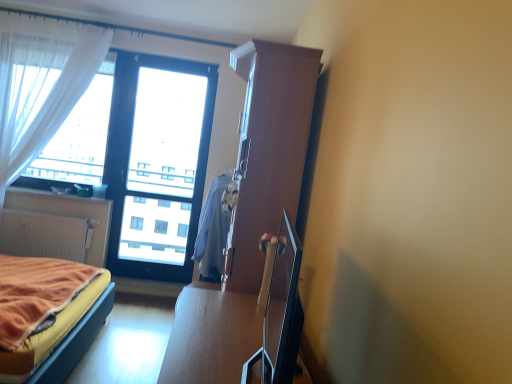
Based on the photo, in order to face matte white radiator at lower left, should I rotate leftwards or rightwards?

Rotate left and turn 26.183 degrees.

Describe the element at coordinates (50, 334) in the screenshot. This screenshot has height=384, width=512. I see `velvet orange bed at lower left` at that location.

Measure the distance between point (74, 96) and camera.

Point (74, 96) is 3.70 meters from camera.

Find the location of a particular element. The width and height of the screenshot is (512, 384). matte white radiator at lower left is located at coordinates (44, 235).

Based on their sizes in the image, would you say velvet orange bed at lower left is bigger or smaller than transparent glass window at center?

Clearly, velvet orange bed at lower left is larger in size than transparent glass window at center.

In the image, is velvet orange bed at lower left positioned in front of or behind transparent glass window at center?

velvet orange bed at lower left is positioned closer to the viewer than transparent glass window at center.

Are velvet orange bed at lower left and transparent glass window at center located far from each other?

Absolutely, velvet orange bed at lower left is distant from transparent glass window at center.

Looking at this image, from the image's perspective, is velvet orange bed at lower left below transparent glass window at center?

Correct, velvet orange bed at lower left appears lower than transparent glass window at center in the image.

Is point (41, 218) more distant than point (215, 239)?

Yes, it is.

Which object is thinner, matte white radiator at lower left or light blue fabric at center?

With smaller width is matte white radiator at lower left.

Which is correct: matte white radiator at lower left is inside light blue fabric at center, or outside of it?

matte white radiator at lower left is located beyond the bounds of light blue fabric at center.

Is matte white radiator at lower left placed right next to light blue fabric at center?

matte white radiator at lower left is not next to light blue fabric at center, and they're not touching.

Is white sheer curtain at left wider or thinner than velvet orange bed at lower left?

Clearly, white sheer curtain at left has less width compared to velvet orange bed at lower left.

Considering the sizes of objects white sheer curtain at left and velvet orange bed at lower left in the image provided, who is taller, white sheer curtain at left or velvet orange bed at lower left?

white sheer curtain at left.

From the image's perspective, which object appears higher, white sheer curtain at left or velvet orange bed at lower left?

white sheer curtain at left.

Is white sheer curtain at left at the right side of velvet orange bed at lower left?

Incorrect, white sheer curtain at left is not on the right side of velvet orange bed at lower left.

From the image's perspective, is matte white radiator at lower left under white sheer curtain at left?

Indeed, from the image's perspective, matte white radiator at lower left is shown beneath white sheer curtain at left.

Would you say matte white radiator at lower left is a long distance from white sheer curtain at left?

No.

Which is nearer, (x=3, y=215) or (x=76, y=69)?

Point (x=3, y=215) is farther from the camera than point (x=76, y=69).

Does point (222, 244) appear closer or farther from the camera than point (34, 243)?

Point (222, 244) is positioned closer to the camera compared to point (34, 243).

Is light blue fabric at center beside matte white radiator at lower left?

No, light blue fabric at center is not beside matte white radiator at lower left.

Considering the relative sizes of light blue fabric at center and matte white radiator at lower left in the image provided, is light blue fabric at center wider than matte white radiator at lower left?

Correct, the width of light blue fabric at center exceeds that of matte white radiator at lower left.

I want to click on radiator below the light blue fabric at center (from a real-world perspective), so click(x=44, y=235).

Measure the distance from transparent glass window at center to light blue fabric at center.

A distance of 1.55 meters exists between transparent glass window at center and light blue fabric at center.

Can we say transparent glass window at center lies outside light blue fabric at center?

Absolutely, transparent glass window at center is external to light blue fabric at center.

From the image's perspective, is transparent glass window at center above or below light blue fabric at center?

transparent glass window at center is above light blue fabric at center.

Is transparent glass window at center in contact with light blue fabric at center?

They are not placed beside each other.

What's the angular difference between white sheer curtain at left and light blue fabric at center's facing directions?

There is a 90.2-degree angle between the facing directions of white sheer curtain at left and light blue fabric at center.

Is white sheer curtain at left at the left side of light blue fabric at center?

Yes.

In the image, there is a white sheer curtain at left. In order to click on blanket below it (from the image's perspective) in this screenshot , I will do `click(212, 232)`.

I want to click on bed in front of the transparent glass window at center, so click(50, 334).

This screenshot has width=512, height=384. Identify the location of blanket located above the matte white radiator at lower left (from a real-world perspective). (212, 232).

Considering their positions, is white sheer curtain at left positioned further to matte white radiator at lower left than light blue fabric at center?

light blue fabric at center lies further to matte white radiator at lower left than the other object.

Based on their spatial positions, is white sheer curtain at left or transparent glass window at center closer to light blue fabric at center?

Among the two, transparent glass window at center is located nearer to light blue fabric at center.

When comparing their distances from matte white radiator at lower left, does transparent glass window at center or white sheer curtain at left seem closer?

white sheer curtain at left is closer to matte white radiator at lower left.

Estimate the real-world distances between objects in this image. Which object is closer to light blue fabric at center, velvet orange bed at lower left or matte white radiator at lower left?

velvet orange bed at lower left.

In the scene shown: Which object lies nearer to the anchor point white sheer curtain at left, light blue fabric at center or velvet orange bed at lower left?

Based on the image, velvet orange bed at lower left appears to be nearer to white sheer curtain at left.

Estimate the real-world distances between objects in this image. Which object is closer to transparent glass window at center, light blue fabric at center or velvet orange bed at lower left?

light blue fabric at center.

When comparing their distances from matte white radiator at lower left, does velvet orange bed at lower left or transparent glass window at center seem further?

The object further to matte white radiator at lower left is velvet orange bed at lower left.

Which object lies further to the anchor point transparent glass window at center, white sheer curtain at left or light blue fabric at center?

light blue fabric at center is further to transparent glass window at center.

Where is `blanket located between velvet orange bed at lower left and white sheer curtain at left in the depth direction`? The image size is (512, 384). blanket located between velvet orange bed at lower left and white sheer curtain at left in the depth direction is located at coordinates (212, 232).

Locate an element on the screen. The height and width of the screenshot is (384, 512). blanket located between velvet orange bed at lower left and transparent glass window at center in the depth direction is located at coordinates (212, 232).

This screenshot has width=512, height=384. In order to click on curtain between matte white radiator at lower left and light blue fabric at center from left to right in this screenshot , I will do `click(41, 83)`.

Locate an element on the screen. window screen between white sheer curtain at left and light blue fabric at center is located at coordinates (164, 166).